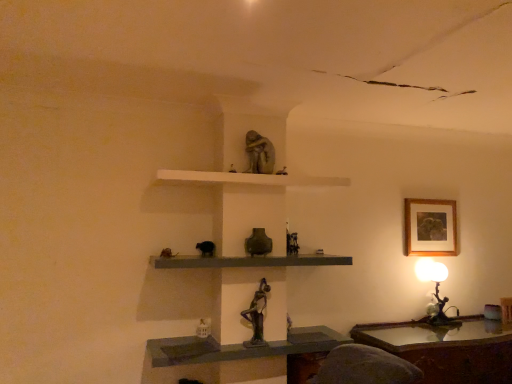
Question: Looking at their shapes, would you say matte gray stone statue at upper center, positioned as the 1th sculpture in top-to-bottom order, is wider or thinner than wooden framed artwork at upper right?

Choices:
 (A) thin
 (B) wide

Answer: (B)

Question: Choose the correct answer: Is matte gray stone statue at upper center, positioned as the 1th sculpture in top-to-bottom order, inside wooden framed artwork at upper right or outside it?

Choices:
 (A) outside
 (B) inside

Answer: (A)

Question: Which object is positioned closest to the matte gray stone statue at upper center, placed as the 2th sculpture when sorted from bottom to top?

Choices:
 (A) bronze statue at center, positioned as the 1th shelf in bottom-to-top order
 (B) wooden polished table at lower right
 (C) wooden framed artwork at upper right
 (D) metallic bronze figurine at right
 (E) white matte shelf at upper center, which is the first shelf in top-to-bottom order

Answer: (E)

Question: Which object is the closest to the matte gray stone statue at upper center, placed as the 2th sculpture when sorted from bottom to top?

Choices:
 (A) wooden polished table at lower right
 (B) wooden framed artwork at upper right
 (C) metallic bronze figurine at right
 (D) white matte shelf at upper center, which is the first shelf in top-to-bottom order
 (E) matte gray shelf at center, acting as the second shelf starting from the top

Answer: (D)